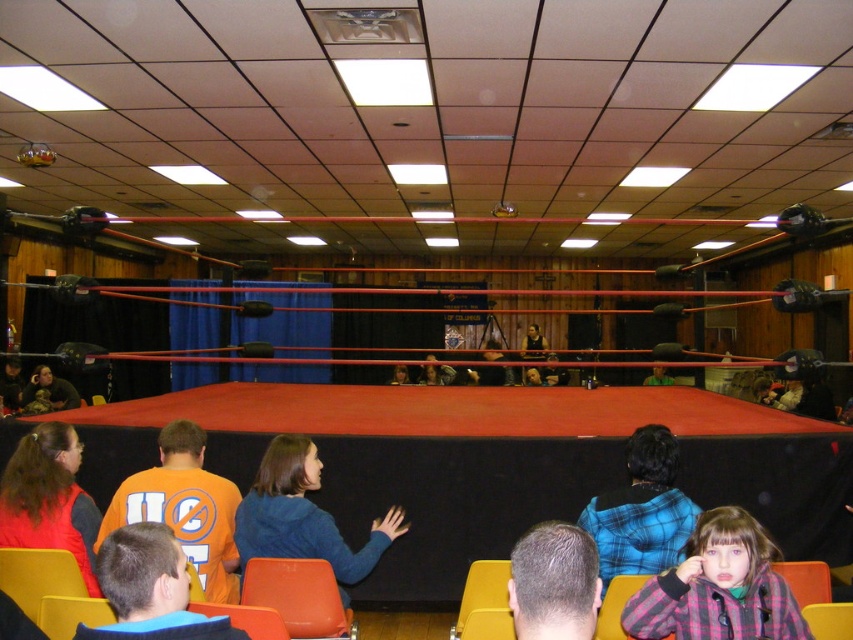
Is orange plastic chair at lower center thinner than matte black jacket at lower left?

Yes.

Does orange plastic chair at lower center appear under matte black jacket at lower left?

Indeed, orange plastic chair at lower center is positioned under matte black jacket at lower left.

Does point (294, 614) lie in front of point (28, 406)?

Yes, point (294, 614) is closer to viewer.

Where is `orange plastic chair at lower center`? Image resolution: width=853 pixels, height=640 pixels. orange plastic chair at lower center is located at coordinates click(297, 595).

Can you confirm if plaid flannel shirt at lower right is smaller than orange plastic chair at lower center?

No.

Which is in front, point (733, 518) or point (244, 573)?

Point (733, 518) is more forward.

Who is more forward, (682, 604) or (328, 611)?

Point (682, 604)

You are a GUI agent. You are given a task and a screenshot of the screen. Output one action in this format:
    pyautogui.click(x=<x>, y=<y>)
    Task: Click on the plaid flannel shirt at lower right
    This screenshot has width=853, height=640.
    Given the screenshot: What is the action you would take?
    pyautogui.click(x=718, y=588)

Does plaid flannel shirt at lower right appear on the left side of matte black jacket at lower left?

Incorrect, plaid flannel shirt at lower right is not on the left side of matte black jacket at lower left.

Image resolution: width=853 pixels, height=640 pixels. Identify the location of plaid flannel shirt at lower right. (718, 588).

This screenshot has height=640, width=853. I want to click on plaid flannel shirt at lower right, so click(x=718, y=588).